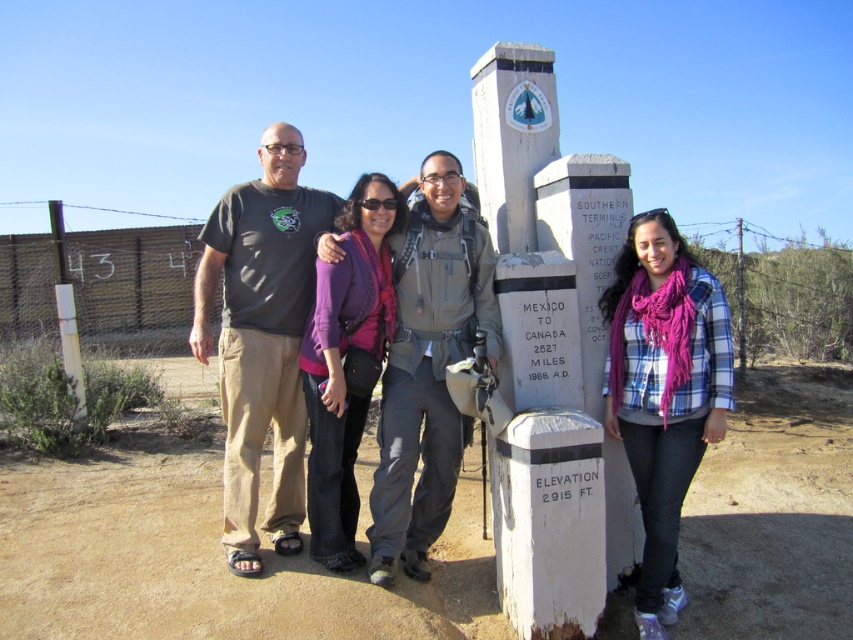
Which is below, dark gray t-shirt at center or plaid shirt at center?

plaid shirt at center is lower down.

Between dark gray t-shirt at center and plaid shirt at center, which one appears on the left side from the viewer's perspective?

From the viewer's perspective, dark gray t-shirt at center appears more on the left side.

Which is behind, point (219, 364) or point (631, 360)?

The point (219, 364) is behind.

Where is `dark gray t-shirt at center`? The width and height of the screenshot is (853, 640). dark gray t-shirt at center is located at coordinates tap(260, 337).

Can you confirm if brown sandy dirt at lower center is smaller than dark gray t-shirt at center?

Yes, brown sandy dirt at lower center is smaller than dark gray t-shirt at center.

This screenshot has height=640, width=853. What do you see at coordinates (204, 557) in the screenshot?
I see `brown sandy dirt at lower center` at bounding box center [204, 557].

Is point (260, 627) positioned before point (279, 250)?

Yes, point (260, 627) is closer to viewer.

Identify the location of brown sandy dirt at lower center. (204, 557).

Does brown sandy dirt at lower center appear under plaid shirt at center?

Indeed, brown sandy dirt at lower center is positioned under plaid shirt at center.

Measure the distance between point (782, 371) and camera.

32.56 feet

The width and height of the screenshot is (853, 640). In order to click on brown sandy dirt at lower center in this screenshot , I will do `click(204, 557)`.

The height and width of the screenshot is (640, 853). Find the location of `brown sandy dirt at lower center`. brown sandy dirt at lower center is located at coordinates (204, 557).